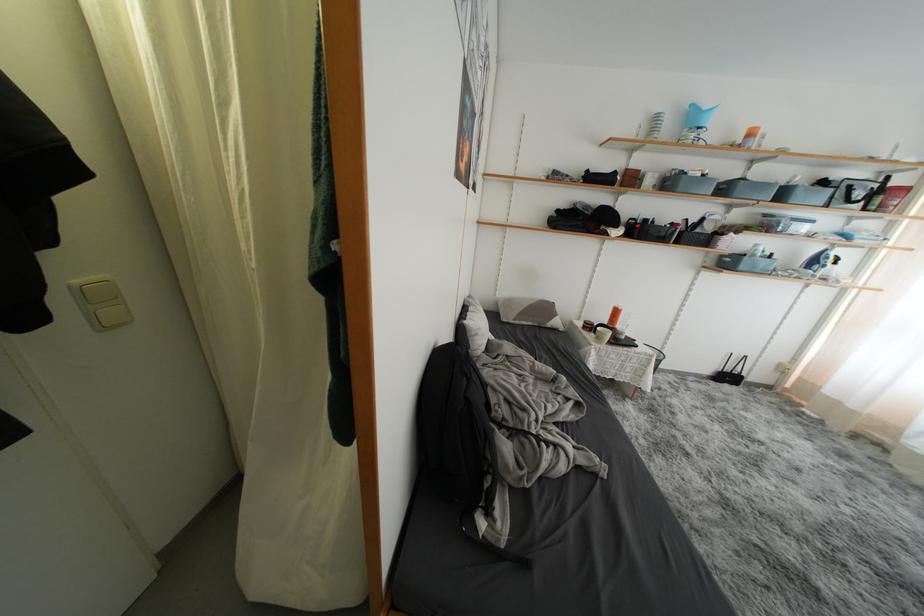
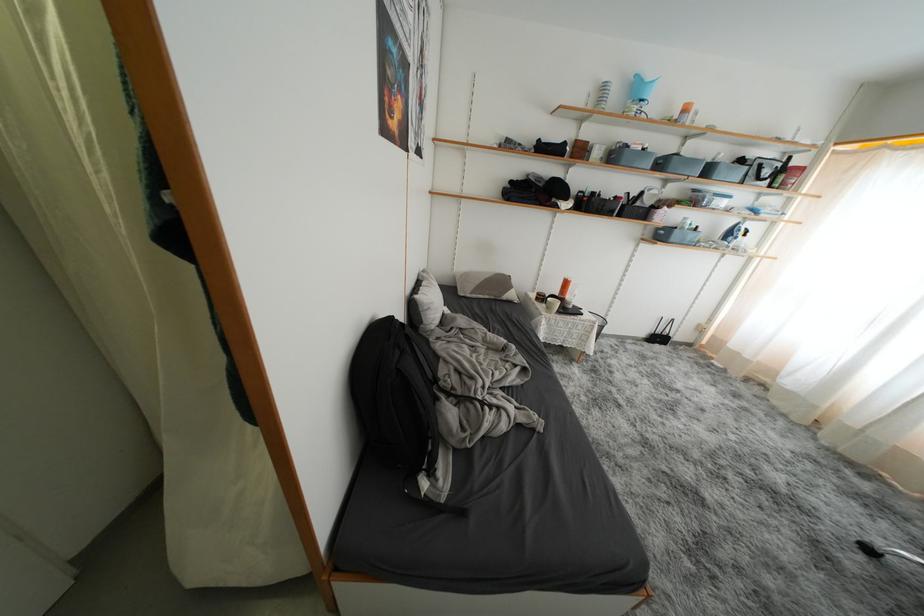
In the second image, find the point that corresponds to point 552,312 in the first image.

(508, 286)